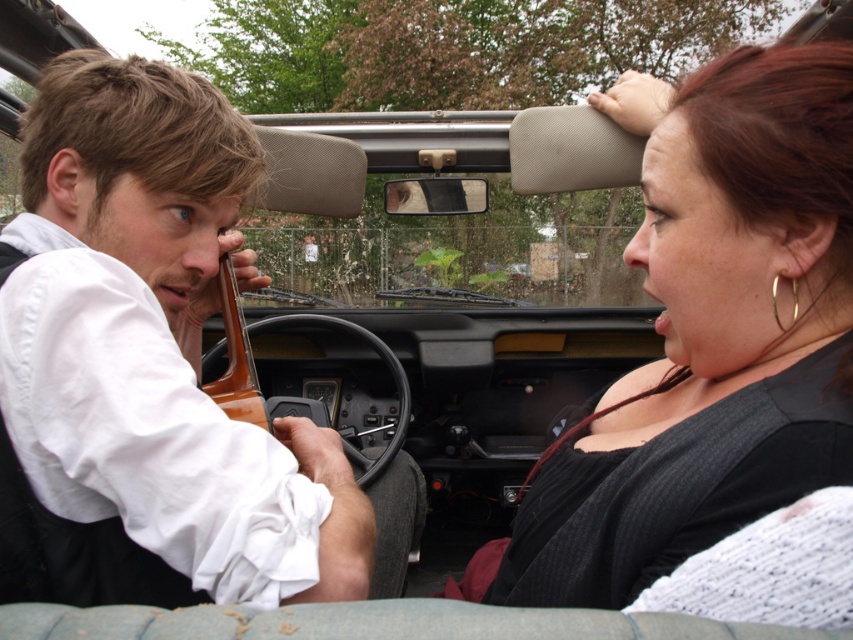
Between wooden violin at left and dark gray ribbed sweater at upper right, which one has more height?

With more height is wooden violin at left.

Does wooden violin at left appear on the left side of dark gray ribbed sweater at upper right?

Indeed, wooden violin at left is positioned on the left side of dark gray ribbed sweater at upper right.

Is point (62, 445) farther from camera compared to point (663, 330)?

That is False.

You are a GUI agent. You are given a task and a screenshot of the screen. Output one action in this format:
    pyautogui.click(x=<x>, y=<y>)
    Task: Click on the wooden violin at left
    Image resolution: width=853 pixels, height=640 pixels.
    Given the screenshot: What is the action you would take?
    pyautogui.click(x=161, y=365)

Does dark gray ribbed sweater at upper right have a larger size compared to brown wood violin at left?

Correct, dark gray ribbed sweater at upper right is larger in size than brown wood violin at left.

Who is positioned more to the left, dark gray ribbed sweater at upper right or brown wood violin at left?

From the viewer's perspective, brown wood violin at left appears more on the left side.

Who is more forward, (x=535, y=541) or (x=253, y=406)?

Point (x=535, y=541)

What are the coordinates of `dark gray ribbed sweater at upper right` in the screenshot? It's located at (712, 339).

Can you confirm if brown wood violin at left is bigger than gold metallic hoop earring at right ear?

Yes, brown wood violin at left is bigger than gold metallic hoop earring at right ear.

Image resolution: width=853 pixels, height=640 pixels. Describe the element at coordinates (234, 358) in the screenshot. I see `brown wood violin at left` at that location.

Image resolution: width=853 pixels, height=640 pixels. Describe the element at coordinates (234, 358) in the screenshot. I see `brown wood violin at left` at that location.

The image size is (853, 640). In order to click on brown wood violin at left in this screenshot , I will do (x=234, y=358).